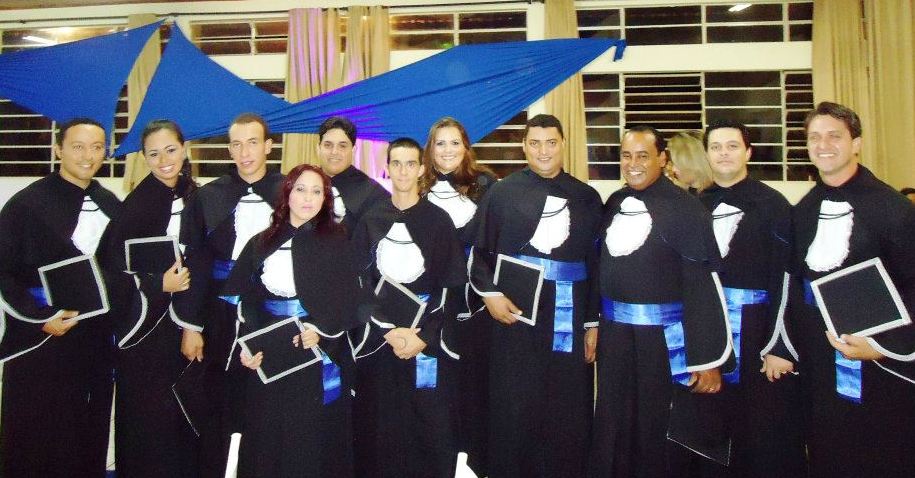
At what (x,y) coordinates should I click in order to perform the action: click on cloth. Please return your answer as a coordinate pair (x, y). The width and height of the screenshot is (915, 478). Looking at the image, I should click on 265,114.